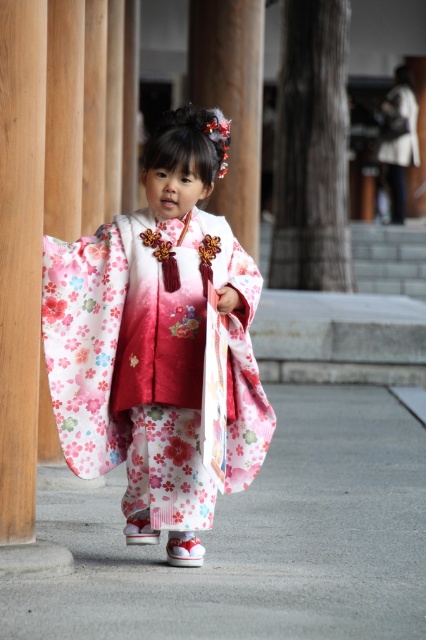
Between white concrete pavement at center and floral silk kimono at center, which one has less height?

white concrete pavement at center

Which is below, white concrete pavement at center or floral silk kimono at center?

white concrete pavement at center is below.

Which is in front, point (353, 544) or point (192, 428)?

Point (192, 428) is more forward.

Identify the location of white concrete pavement at center. This screenshot has width=426, height=640. (256, 540).